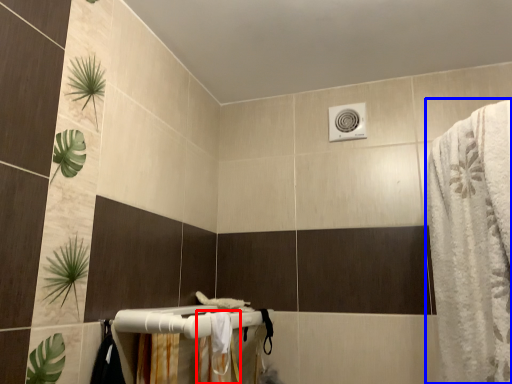
Question: Among these objects, which one is farthest to the camera, shower curtain (highlighted by a red box) or bath towel (highlighted by a blue box)?

Choices:
 (A) shower curtain
 (B) bath towel

Answer: (A)